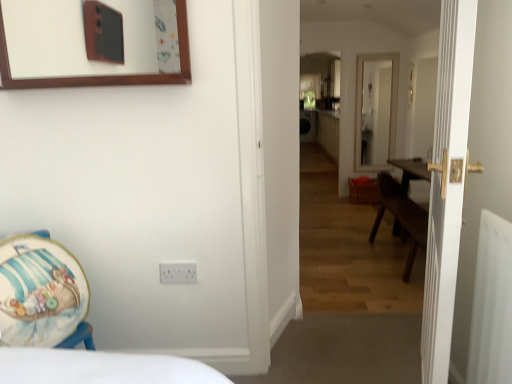
Question: From the image's perspective, relative to white plastic radiator at right, is white wooden door at right above or below?

Choices:
 (A) above
 (B) below

Answer: (A)

Question: In the image, is white wooden door at right positioned in front of or behind white plastic radiator at right?

Choices:
 (A) behind
 (B) front

Answer: (B)

Question: Based on their relative distances, which object is farther from the white plastic electric outlet at lower center?

Choices:
 (A) brown wooden picture frame at upper left
 (B) wooden floor at center
 (C) white plastic radiator at right
 (D) wooden armchair at lower left
 (E) white wooden door at right

Answer: (B)

Question: Which of these objects is positioned farthest from the wooden floor at center?

Choices:
 (A) brown wooden picture frame at upper left
 (B) white plastic radiator at right
 (C) white plastic electric outlet at lower center
 (D) wooden armchair at lower left
 (E) white wooden door at right

Answer: (D)